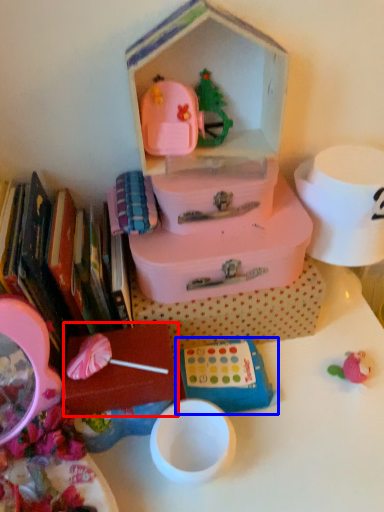
Question: Which point is further to the camera, storage box (highlighted by a red box) or toy (highlighted by a blue box)?

Choices:
 (A) storage box
 (B) toy

Answer: (B)